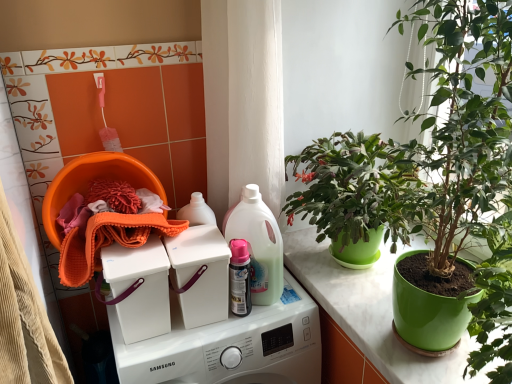
This screenshot has width=512, height=384. What do you see at coordinates (428, 316) in the screenshot?
I see `green plastic pot at right` at bounding box center [428, 316].

Locate an element on the screen. The height and width of the screenshot is (384, 512). translucent plastic spray bottle at center is located at coordinates (258, 244).

Where is `orange microfiber cloth at left`? The width and height of the screenshot is (512, 384). orange microfiber cloth at left is located at coordinates (105, 227).

This screenshot has width=512, height=384. Describe the element at coordinates (229, 346) in the screenshot. I see `white plastic washing machine at center, placed as the 2th washing machine when sorted from top to bottom` at that location.

Locate an element on the screen. The height and width of the screenshot is (384, 512). white plastic washing machine at center, which ranks as the second washing machine in bottom-to-top order is located at coordinates (200, 274).

At what (x,y) coordinates should I click in order to perform the action: click on green plastic pot at right. Please return your answer as a coordinate pair (x, y). The height and width of the screenshot is (384, 512). Looking at the image, I should click on (428, 316).

Considering the sizes of translucent plastic spray bottle at center and green plastic pot at right in the image, is translucent plastic spray bottle at center wider or thinner than green plastic pot at right?

A: In the image, translucent plastic spray bottle at center appears to be more narrow than green plastic pot at right.

From the image's perspective, which is below, translucent plastic spray bottle at center or green plastic pot at right?

green plastic pot at right.

Measure the distance between translucent plastic spray bottle at center and green plastic pot at right.

translucent plastic spray bottle at center and green plastic pot at right are 16.87 inches apart from each other.

Where is `flowerpot on the right of translucent plastic spray bottle at center`? The height and width of the screenshot is (384, 512). flowerpot on the right of translucent plastic spray bottle at center is located at coordinates (428, 316).

How many degrees apart are the facing directions of green matte plant pot at center and pink glossy spray can at center?

green matte plant pot at center and pink glossy spray can at center are facing 89.1 degrees away from each other.

Is green matte plant pot at center facing towards pink glossy spray can at center?

No, green matte plant pot at center does not turn towards pink glossy spray can at center.

Is green matte plant pot at center with pink glossy spray can at center?

No, green matte plant pot at center is not making contact with pink glossy spray can at center.

Does green matte plant pot at center lie in front of pink glossy spray can at center?

That is True.

Which object is thinner, white plastic washing machine at center, which ranks as the first washing machine in bottom-to-top order, or green plastic pot at right?

green plastic pot at right.

From a real-world perspective, is white plastic washing machine at center, which ranks as the first washing machine in bottom-to-top order, positioned above or below green plastic pot at right?

From a real-world perspective, white plastic washing machine at center, which ranks as the first washing machine in bottom-to-top order, is physically below green plastic pot at right.

How distant is white plastic washing machine at center, which ranks as the first washing machine in bottom-to-top order, from green plastic pot at right?

white plastic washing machine at center, which ranks as the first washing machine in bottom-to-top order, is 17.26 inches away from green plastic pot at right.

Locate an element on the screen. flowerpot located above the white plastic washing machine at center, placed as the 2th washing machine when sorted from top to bottom (from a real-world perspective) is located at coordinates (428, 316).

Is white plastic washing machine at center, which ranks as the first washing machine in bottom-to-top order, bigger or smaller than orange microfiber cloth at left?

Clearly, white plastic washing machine at center, which ranks as the first washing machine in bottom-to-top order, is larger in size than orange microfiber cloth at left.

Based on the photo, considering their positions, is white plastic washing machine at center, placed as the 2th washing machine when sorted from top to bottom, located in front of or behind orange microfiber cloth at left?

white plastic washing machine at center, placed as the 2th washing machine when sorted from top to bottom, is in front of orange microfiber cloth at left.

This screenshot has width=512, height=384. What are the coordinates of `material behind the white plastic washing machine at center, placed as the 2th washing machine when sorted from top to bottom` in the screenshot? It's located at (105, 227).

From a real-world perspective, between translucent plastic spray bottle at center and white plastic washing machine at center, which ranks as the first washing machine in bottom-to-top order, who is vertically higher?

translucent plastic spray bottle at center is physically above.

Is translucent plastic spray bottle at center in front of or behind white plastic washing machine at center, placed as the 2th washing machine when sorted from top to bottom, in the image?

Clearly, translucent plastic spray bottle at center is behind white plastic washing machine at center, placed as the 2th washing machine when sorted from top to bottom.

This screenshot has width=512, height=384. There is a white plastic washing machine at center, which ranks as the first washing machine in bottom-to-top order. What are the coordinates of `cleaning product above it (from a real-world perspective)` in the screenshot? It's located at (258, 244).

Is translucent plastic spray bottle at center wider or thinner than white plastic washing machine at center, which ranks as the first washing machine in bottom-to-top order?

Clearly, translucent plastic spray bottle at center has less width compared to white plastic washing machine at center, which ranks as the first washing machine in bottom-to-top order.

From the picture: From a real-world perspective, is white plastic washing machine at center, which ranks as the first washing machine in bottom-to-top order, positioned over green matte plant at upper right based on gravity?

No, from a real-world perspective, white plastic washing machine at center, which ranks as the first washing machine in bottom-to-top order, is not above green matte plant at upper right.

From the picture: Considering the sizes of objects white plastic washing machine at center, which ranks as the first washing machine in bottom-to-top order, and green matte plant at upper right in the image provided, who is wider, white plastic washing machine at center, which ranks as the first washing machine in bottom-to-top order, or green matte plant at upper right?

Wider between the two is white plastic washing machine at center, which ranks as the first washing machine in bottom-to-top order.

Can you confirm if white plastic washing machine at center, which ranks as the first washing machine in bottom-to-top order, is positioned to the left of green matte plant at upper right?

Yes.

Considering the sizes of objects green matte plant at upper right and white plastic washing machine at center, the first washing machine viewed from the top, in the image provided, who is thinner, green matte plant at upper right or white plastic washing machine at center, the first washing machine viewed from the top,?

With smaller width is white plastic washing machine at center, the first washing machine viewed from the top.

From the image's perspective, which object appears higher, green matte plant at upper right or white plastic washing machine at center, which ranks as the second washing machine in bottom-to-top order?

green matte plant at upper right is shown above in the image.

Considering the sizes of green matte plant at upper right and white plastic washing machine at center, the first washing machine viewed from the top, in the image, is green matte plant at upper right bigger or smaller than white plastic washing machine at center, the first washing machine viewed from the top,?

A: Clearly, green matte plant at upper right is larger in size than white plastic washing machine at center, the first washing machine viewed from the top.

Is green matte plant at upper right not close to white plastic washing machine at center, the first washing machine viewed from the top?

No, green matte plant at upper right is not far away from white plastic washing machine at center, the first washing machine viewed from the top.

Identify the location of cleaning product lying above the green plastic pot at right (from the image's perspective). The image size is (512, 384). (258, 244).

Locate an element on the screen. The height and width of the screenshot is (384, 512). counter below the pink glossy spray can at center (from a real-world perspective) is located at coordinates (365, 318).

Based on their spatial positions, is white plastic washing machine at center, which ranks as the second washing machine in bottom-to-top order, or translucent plastic spray bottle at center closer to green plastic pot at right?

translucent plastic spray bottle at center is closer to green plastic pot at right.

Based on their spatial positions, is translucent plastic spray bottle at center or green plastic pot at right closer to green matte plant at upper right?

The object closer to green matte plant at upper right is green plastic pot at right.

Considering their positions, is white plastic washing machine at center, which ranks as the second washing machine in bottom-to-top order, positioned closer to green matte plant at upper right than pink glossy spray can at center?

pink glossy spray can at center lies closer to green matte plant at upper right than the other object.

Which object lies further to the anchor point orange microfiber cloth at left, pink glossy spray can at center or green matte plant at upper right?

green matte plant at upper right lies further to orange microfiber cloth at left than the other object.

Looking at the image, which one is located closer to green plastic pot at right, white plastic washing machine at center, which ranks as the second washing machine in bottom-to-top order, or white plastic washing machine at center, which ranks as the first washing machine in bottom-to-top order?

Based on the image, white plastic washing machine at center, which ranks as the first washing machine in bottom-to-top order, appears to be nearer to green plastic pot at right.

Which object lies further to the anchor point pink glossy spray can at center, white plastic washing machine at center, placed as the 2th washing machine when sorted from top to bottom, or orange microfiber cloth at left?

Based on the image, orange microfiber cloth at left appears to be further to pink glossy spray can at center.

Looking at the image, which one is located further to green plastic pot at right, white plastic washing machine at center, placed as the 2th washing machine when sorted from top to bottom, or white plastic washing machine at center, which ranks as the second washing machine in bottom-to-top order?

The object further to green plastic pot at right is white plastic washing machine at center, which ranks as the second washing machine in bottom-to-top order.

When comparing their distances from white plastic washing machine at center, the first washing machine viewed from the top, does green matte plant pot at center or green matte plant at upper right seem closer?

green matte plant pot at center lies closer to white plastic washing machine at center, the first washing machine viewed from the top, than the other object.

Where is `bottle situated between white plastic washing machine at center, which ranks as the second washing machine in bottom-to-top order, and translucent plastic spray bottle at center from left to right`? The image size is (512, 384). bottle situated between white plastic washing machine at center, which ranks as the second washing machine in bottom-to-top order, and translucent plastic spray bottle at center from left to right is located at coordinates [239, 278].

I want to click on cleaning product situated between white plastic washing machine at center, placed as the 2th washing machine when sorted from top to bottom, and green plastic pot at right from left to right, so click(x=258, y=244).

Where is `cleaning product positioned between green matte plant at upper right and pink glossy spray can at center from near to far`? The width and height of the screenshot is (512, 384). cleaning product positioned between green matte plant at upper right and pink glossy spray can at center from near to far is located at coordinates [258, 244].

Image resolution: width=512 pixels, height=384 pixels. Find the location of `bottle between green matte plant at upper right and white plastic washing machine at center, which ranks as the first washing machine in bottom-to-top order, in the up-down direction`. bottle between green matte plant at upper right and white plastic washing machine at center, which ranks as the first washing machine in bottom-to-top order, in the up-down direction is located at coordinates pyautogui.click(x=239, y=278).